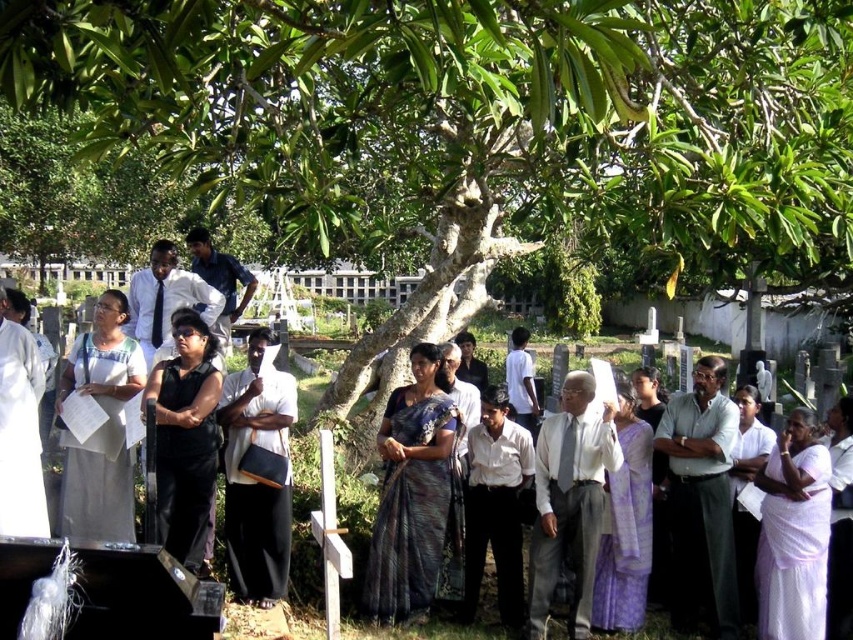
Looking at this image, which is above, dark purple silk saree at center or dark blue shirt at center?

dark blue shirt at center is above.

Is the position of dark purple silk saree at center more distant than that of dark blue shirt at center?

That is False.

Is point (407, 572) more distant than point (230, 282)?

No.

At what (x,y) coordinates should I click in order to perform the action: click on dark purple silk saree at center. Please return your answer as a coordinate pair (x, y). The image size is (853, 640). Looking at the image, I should click on (410, 492).

Does white shirt at center have a lesser height compared to dark blue shirt at center?

Indeed, white shirt at center has a lesser height compared to dark blue shirt at center.

Is white shirt at center bigger than dark blue shirt at center?

Actually, white shirt at center might be smaller than dark blue shirt at center.

Which is in front, point (163, 282) or point (218, 266)?

Point (163, 282) is in front.

I want to click on white shirt at center, so click(166, 298).

Can you confirm if light gray shirt at center is positioned to the left of light gray fabric shirt at center?

No, light gray shirt at center is not to the left of light gray fabric shirt at center.

The width and height of the screenshot is (853, 640). What do you see at coordinates (701, 500) in the screenshot?
I see `light gray shirt at center` at bounding box center [701, 500].

I want to click on light gray shirt at center, so coord(701,500).